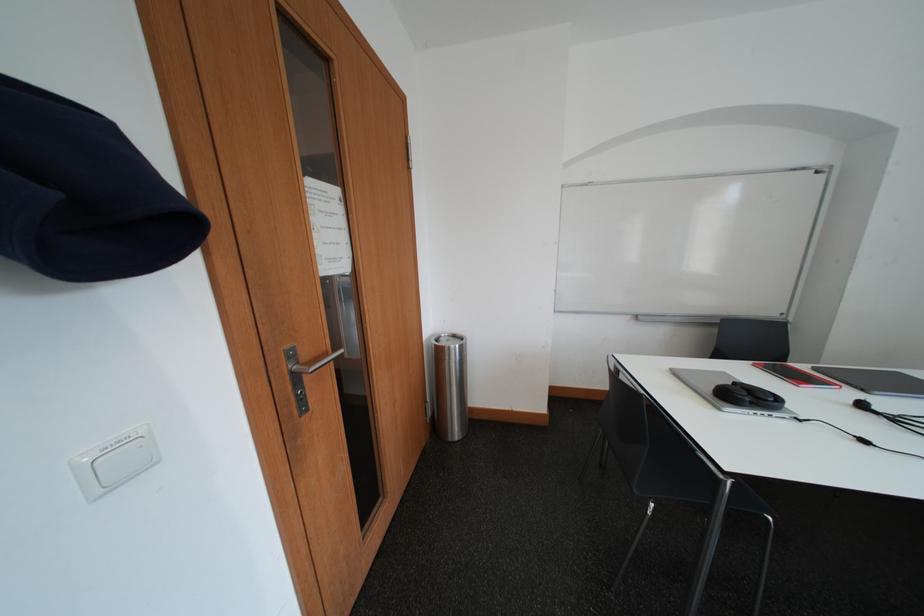
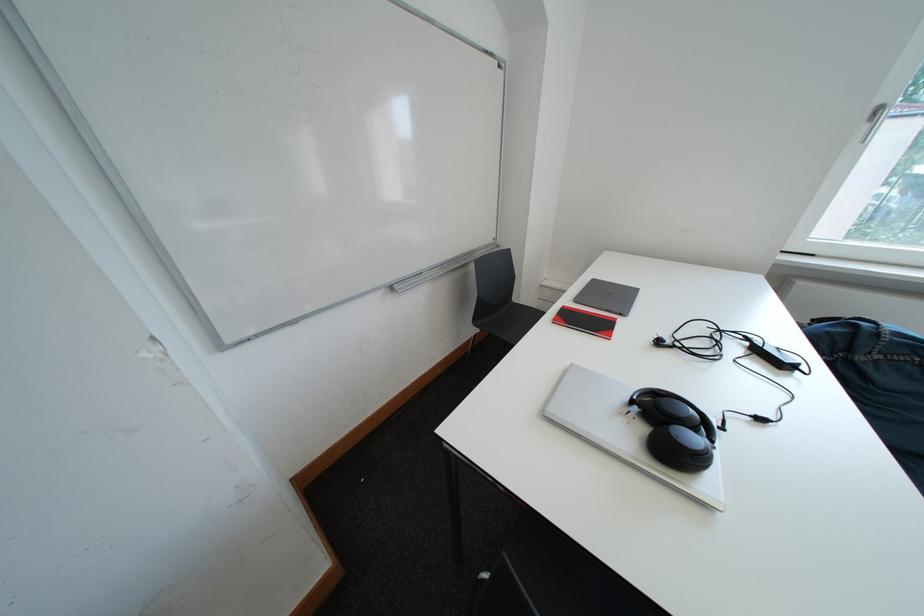
Where in the second image is the point corresponding to pixel 745 387 from the first image?

(642, 405)